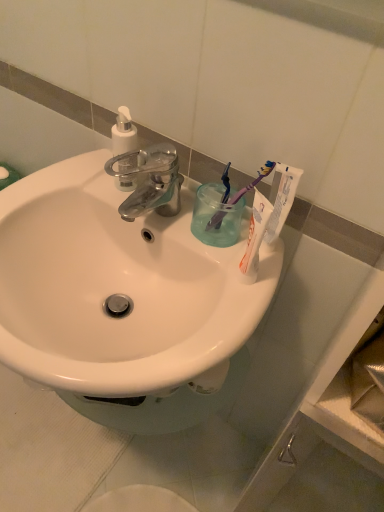
The width and height of the screenshot is (384, 512). What are the coordinates of `free region on the left part of blue plastic toothbrush at upper right, the first toothbrush when ordered from left to right` in the screenshot? It's located at (160, 208).